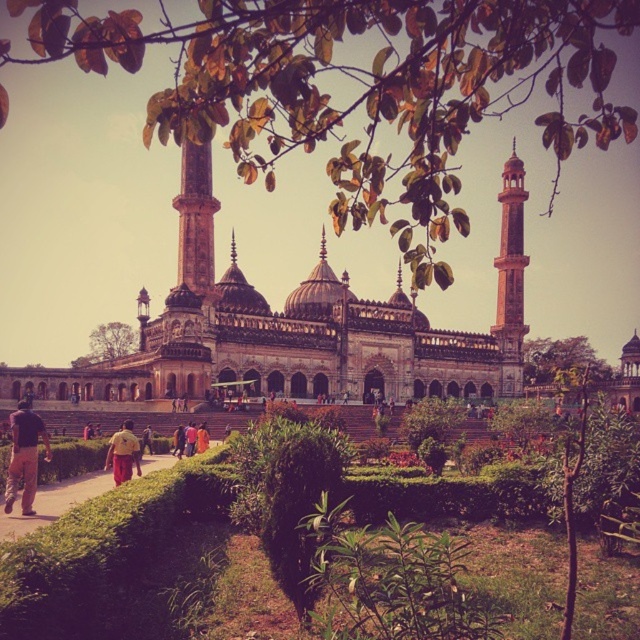
Question: Which is farther from the stone minaret at center right?

Choices:
 (A) yellow fabric pants at lower center
 (B) green leafy garden at center
 (C) brown cotton pants at lower left

Answer: (C)

Question: Does brown cotton pants at lower left have a lesser width compared to yellow fabric pants at lower center?

Choices:
 (A) yes
 (B) no

Answer: (B)

Question: Does green leafy garden at center appear on the left side of brown cotton pants at lower left?

Choices:
 (A) yes
 (B) no

Answer: (B)

Question: Which object is positioned farthest from the brown cotton pants at lower left?

Choices:
 (A) green leafy garden at center
 (B) stone minaret at center right

Answer: (B)

Question: Which point appears closest to the camera in this image?

Choices:
 (A) (106, 618)
 (B) (192, 396)

Answer: (A)

Question: Is stone dome at center thinner than green leafy garden at center?

Choices:
 (A) yes
 (B) no

Answer: (B)